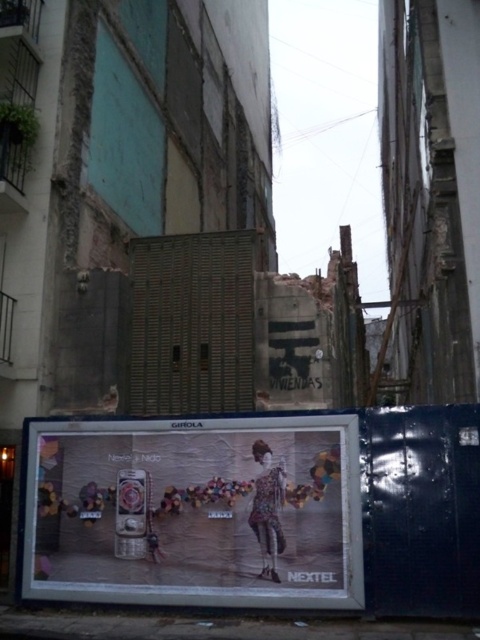
Question: Can you confirm if matte silver phone at center is positioned below floral fabric dress at center?

Choices:
 (A) yes
 (B) no

Answer: (A)

Question: Does matte silver phone at center have a greater width compared to floral fabric dress at center?

Choices:
 (A) no
 (B) yes

Answer: (B)

Question: Which object appears farthest from the camera in this image?

Choices:
 (A) matte silver phone at center
 (B) floral fabric dress at center

Answer: (B)

Question: Which point is closer to the camera?

Choices:
 (A) matte silver phone at center
 (B) floral fabric dress at center

Answer: (A)

Question: Can you confirm if matte silver phone at center is positioned below floral fabric dress at center?

Choices:
 (A) no
 (B) yes

Answer: (B)